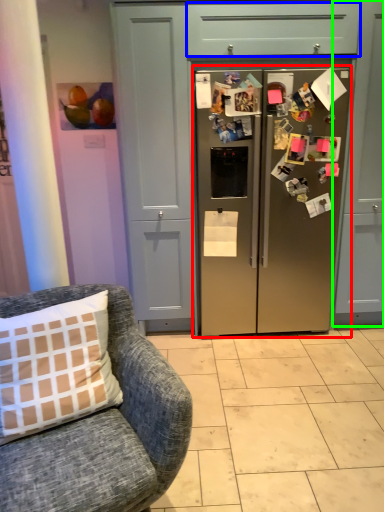
Question: Which is nearer to the refrigerator (highlighted by a red box)? drawer (highlighted by a blue box) or cabinetry (highlighted by a green box).

Choices:
 (A) drawer
 (B) cabinetry

Answer: (B)